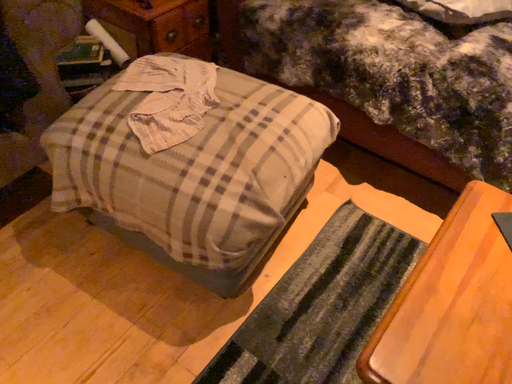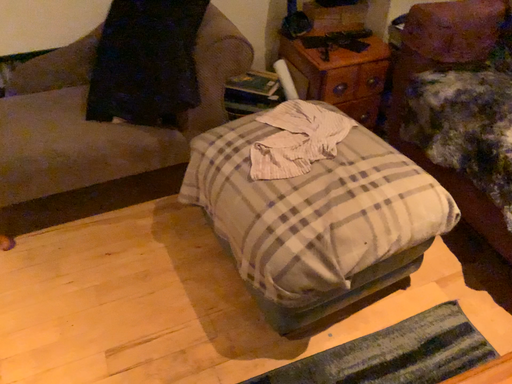
Question: Which way did the camera rotate in the video?

Choices:
 (A) rotated downward
 (B) rotated upward

Answer: (B)